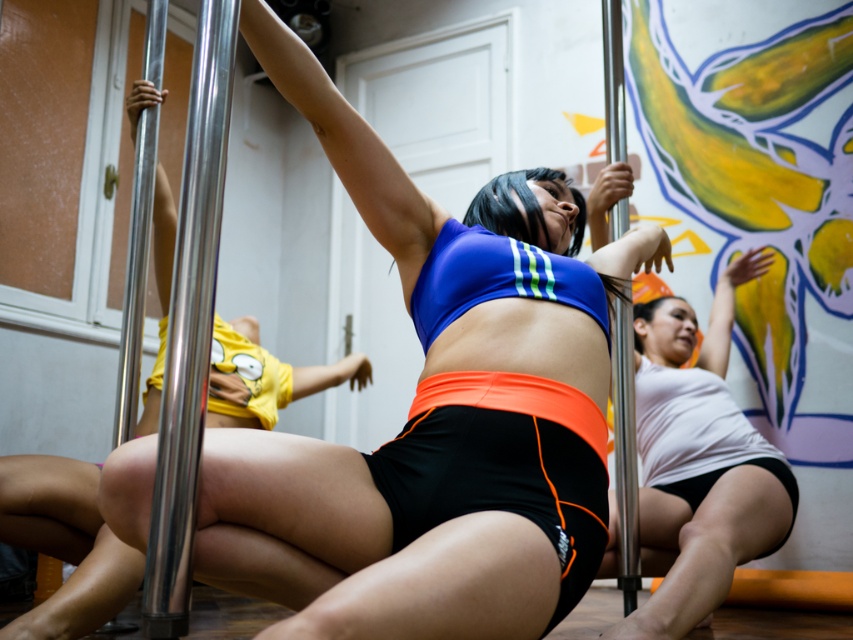
Does polished silver pole at left have a greater width compared to silver metallic pole at center?

No.

Is polished silver pole at left shorter than silver metallic pole at center?

Yes.

What are the coordinates of `polished silver pole at left` in the screenshot? It's located at (189, 324).

Does white matte tank top at center have a greater height compared to polished silver pole at left?

Indeed, white matte tank top at center has a greater height compared to polished silver pole at left.

Between point (714, 596) and point (204, 193), which one is positioned in front?

Point (204, 193)

Identify the location of white matte tank top at center. This screenshot has width=853, height=640. (699, 465).

Where is `matte blue sports bra at center`? This screenshot has height=640, width=853. matte blue sports bra at center is located at coordinates (360, 548).

Is matte blue sports bra at center thinner than polished silver pole at left?

No, matte blue sports bra at center is not thinner than polished silver pole at left.

Does point (328, 627) lie behind point (173, 464)?

No, (328, 627) is in front of (173, 464).

You are a GUI agent. You are given a task and a screenshot of the screen. Output one action in this format:
    pyautogui.click(x=<x>, y=<y>)
    Task: Click on the matte blue sports bra at center
    The height and width of the screenshot is (640, 853).
    Given the screenshot: What is the action you would take?
    pyautogui.click(x=360, y=548)